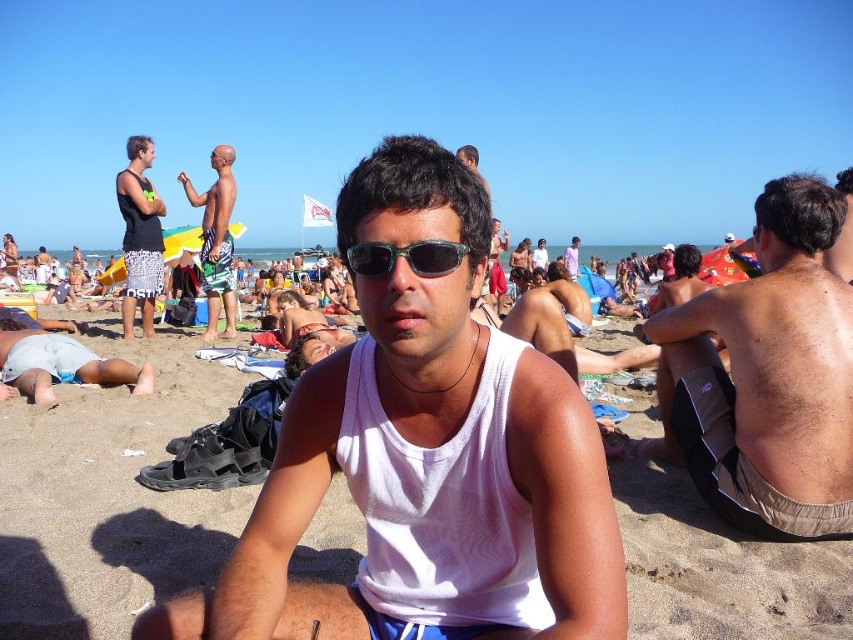
Question: Does brown fabric shorts at right come in front of matte black tank top at left?

Choices:
 (A) yes
 (B) no

Answer: (A)

Question: Can you confirm if brown fabric shorts at right is wider than matte black tank top at left?

Choices:
 (A) yes
 (B) no

Answer: (A)

Question: Considering the real-world distances, which object is closest to the matte black sunglasses at upper center?

Choices:
 (A) black plastic sunglasses at center
 (B) brown fabric shorts at right
 (C) matte black tank top at left

Answer: (A)

Question: Considering the relative positions of black plastic sunglasses at center and matte black sunglasses at upper center in the image provided, where is black plastic sunglasses at center located with respect to matte black sunglasses at upper center?

Choices:
 (A) above
 (B) below

Answer: (B)

Question: Among these points, which one is farthest from the camera?

Choices:
 (A) coord(399,573)
 (B) coord(473,154)

Answer: (B)

Question: Which point is farther to the camera?

Choices:
 (A) brown fabric shorts at right
 (B) matte black sunglasses at upper center
 (C) black plastic sunglasses at center
 (D) matte black tank top at left

Answer: (D)